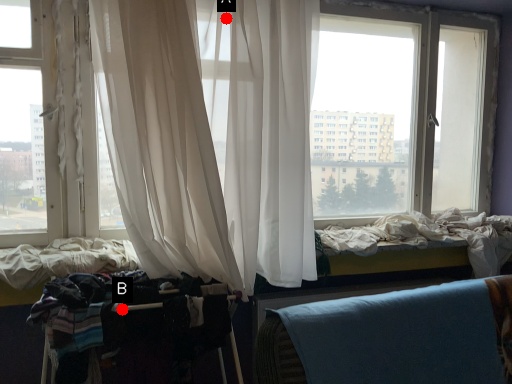
Question: Two points are circled on the image, labeled by A and B beside each circle. Which point is farther from the camera taking this photo?

Choices:
 (A) A is further
 (B) B is further

Answer: (A)